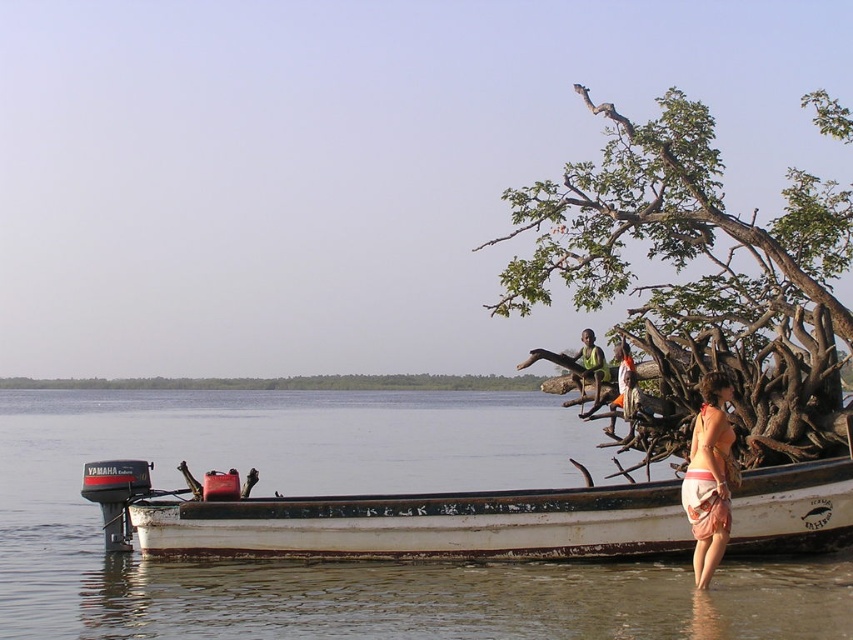
Question: Which point is closer to the camera?

Choices:
 (A) white weathered wood boat at center
 (B) white matte water at lower left
 (C) pink fabric bikini at lower right
 (D) green fabric shirt at center

Answer: (B)

Question: From the image, what is the correct spatial relationship of green leafy tree at upper right in relation to pink fabric bikini at lower right?

Choices:
 (A) above
 (B) below

Answer: (A)

Question: Is white matte water at lower left to the left of pink fabric bikini at lower right from the viewer's perspective?

Choices:
 (A) no
 (B) yes

Answer: (B)

Question: Which of the following is the closest to the observer?

Choices:
 (A) (715, 428)
 (B) (593, 404)
 (C) (125, 634)
 (D) (816, 317)

Answer: (C)

Question: Which object is closer to the camera taking this photo?

Choices:
 (A) white matte water at lower left
 (B) green fabric shirt at center
 (C) pink fabric bikini at lower right
 (D) white weathered wood boat at center

Answer: (A)

Question: Can you confirm if white matte water at lower left is smaller than pink fabric bikini at lower right?

Choices:
 (A) no
 (B) yes

Answer: (A)